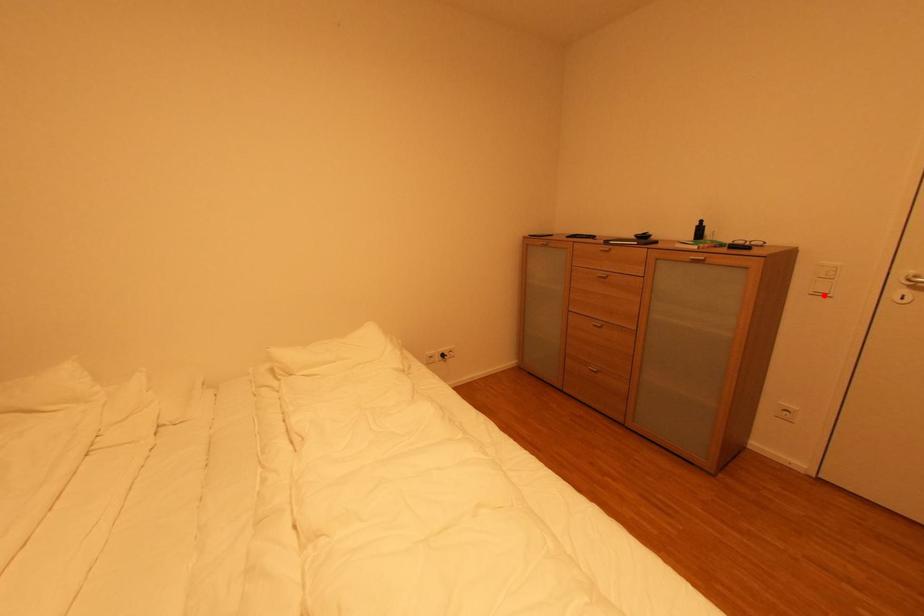
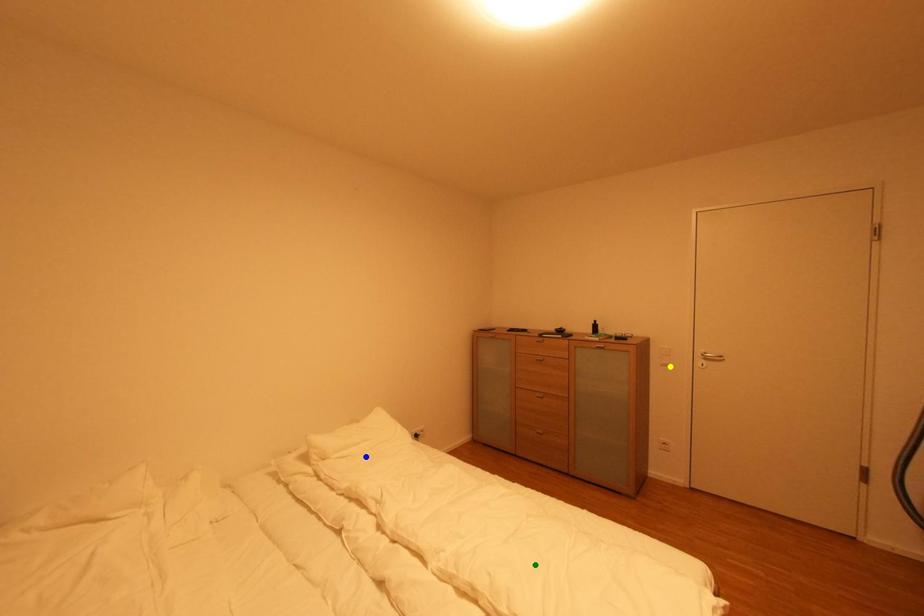
Question: I am providing you with two images of the same scene from different viewpoints. A red point is marked on the first image. You are given multiple points on the second image. Which spot in image 2 lines up with the point in image 1?

Choices:
 (A) green point
 (B) yellow point
 (C) blue point

Answer: (B)